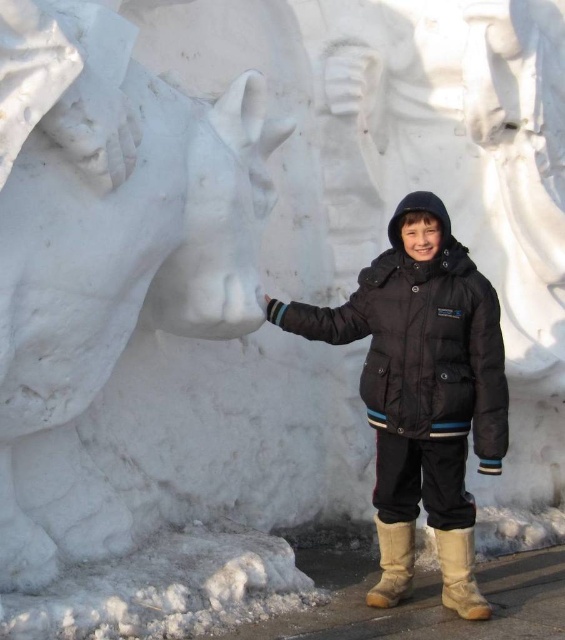
Question: Which object appears closest to the camera in this image?

Choices:
 (A) leather at lower right
 (B) brown suede boot at lower center
 (C) black matte jacket at center

Answer: (A)

Question: Observing the image, what is the correct spatial positioning of black matte jacket at center in reference to leather at lower right?

Choices:
 (A) below
 (B) above

Answer: (B)

Question: Which object is positioned farthest from the brown suede boot at lower center?

Choices:
 (A) black matte jacket at center
 (B) leather at lower right

Answer: (A)

Question: Can you confirm if black matte jacket at center is positioned above brown suede boot at lower center?

Choices:
 (A) no
 (B) yes

Answer: (B)

Question: Is black matte jacket at center wider than leather at lower right?

Choices:
 (A) no
 (B) yes

Answer: (B)

Question: Among these points, which one is nearest to the camera?

Choices:
 (A) (386, 538)
 (B) (477, 620)

Answer: (B)